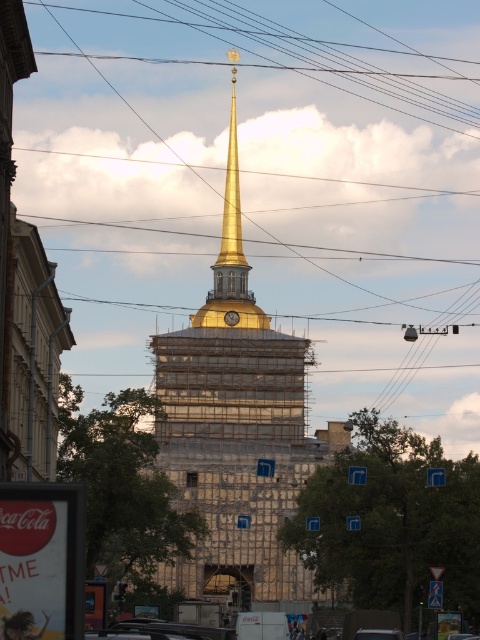
Question: Is gold metallic spire at center thinner than gold polished spire at center?

Choices:
 (A) no
 (B) yes

Answer: (A)

Question: Does metallic wire at upper center appear on the right side of gold polished spire at center?

Choices:
 (A) yes
 (B) no

Answer: (A)

Question: Is gold metallic spire at center in front of metallic wire at upper center?

Choices:
 (A) yes
 (B) no

Answer: (A)

Question: Which of the following is the farthest from the observer?

Choices:
 (A) (478, 77)
 (B) (230, 282)
 (C) (178, 580)

Answer: (A)

Question: Which object is the closest to the gold metallic spire at center?

Choices:
 (A) metallic wire at upper center
 (B) gold polished spire at center

Answer: (B)

Question: Among these points, which one is nearest to the camera?

Choices:
 (A) (244, 483)
 (B) (226, 240)
 (C) (266, 49)

Answer: (A)